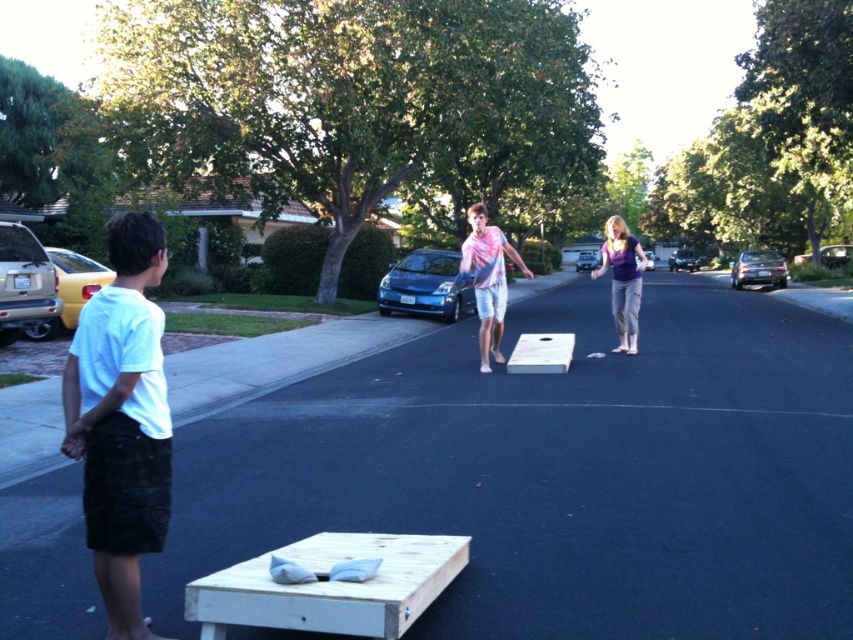
Is point (109, 586) behind point (505, 305)?

No, it is in front of (505, 305).

Looking at this image, can you confirm if white cotton t-shirt at left is positioned to the right of light pink tie-dye shirt at center?

In fact, white cotton t-shirt at left is to the left of light pink tie-dye shirt at center.

The image size is (853, 640). What do you see at coordinates (120, 419) in the screenshot?
I see `white cotton t-shirt at left` at bounding box center [120, 419].

In order to click on white cotton t-shirt at left in this screenshot , I will do `click(120, 419)`.